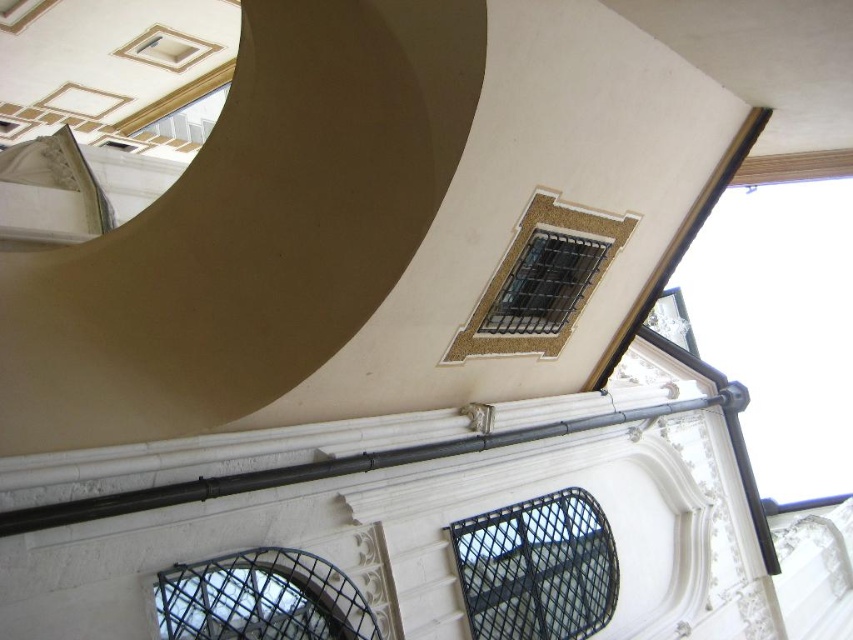
Between black mesh window at upper center and black metal grid at lower left, which one is positioned lower?

black mesh window at upper center is lower down.

Is black mesh window at upper center below black metal grid at lower left?

Indeed, black mesh window at upper center is positioned under black metal grid at lower left.

I want to click on black mesh window at upper center, so click(x=537, y=568).

Who is taller, black metal pipe at center or black metal grid at lower left?

Standing taller between the two is black metal grid at lower left.

Can you confirm if black metal pipe at center is smaller than black metal grid at lower left?

Incorrect, black metal pipe at center is not smaller in size than black metal grid at lower left.

Is point (70, 509) farther from camera compared to point (241, 596)?

No, (70, 509) is closer to viewer.

You are a GUI agent. You are given a task and a screenshot of the screen. Output one action in this format:
    pyautogui.click(x=<x>, y=<y>)
    Task: Click on the black metal pipe at center
    Image resolution: width=853 pixels, height=640 pixels.
    Given the screenshot: What is the action you would take?
    pyautogui.click(x=323, y=468)

Does black mesh window at upper center appear under metallic mesh window at upper center?

Yes, black mesh window at upper center is below metallic mesh window at upper center.

Who is more forward, (x=611, y=536) or (x=546, y=260)?

Point (x=546, y=260) is more forward.

Is point (567, 541) behind point (553, 300)?

Yes, it is behind point (553, 300).

Where is `black mesh window at upper center`? Image resolution: width=853 pixels, height=640 pixels. black mesh window at upper center is located at coordinates (537, 568).